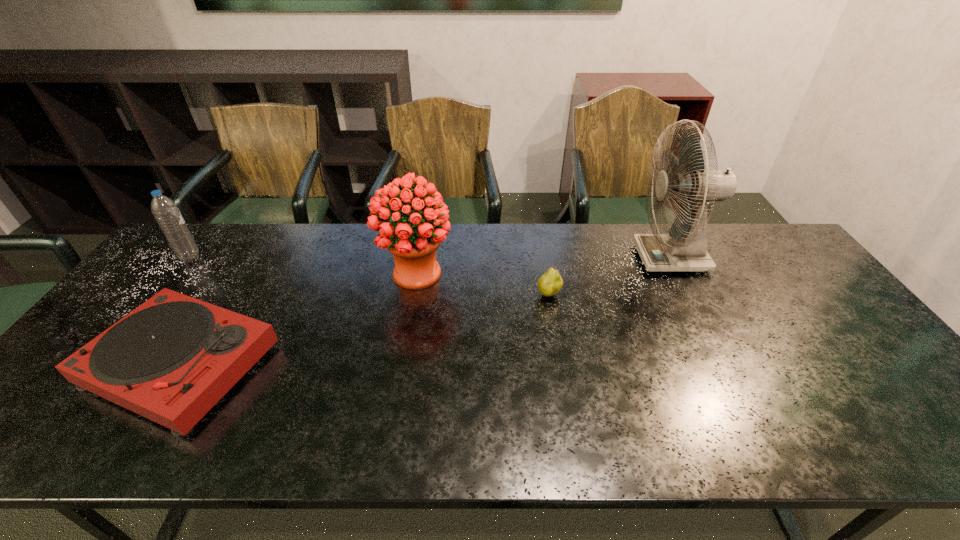
Locate an element on the screen. The height and width of the screenshot is (540, 960). fan is located at coordinates (684, 249).

Find the location of a particular element. the tallest object is located at coordinates (684, 249).

Locate an element on the screen. bouquet is located at coordinates (413, 242).

Where is `the second tallest object`? This screenshot has height=540, width=960. the second tallest object is located at coordinates (413, 242).

This screenshot has height=540, width=960. Find the location of `the third shortest object`. the third shortest object is located at coordinates (165, 211).

You are a GUI agent. You are given a task and a screenshot of the screen. Output one action in this format:
    pyautogui.click(x=<x>, y=<y>)
    Task: Click on the second object from right to left
    Image resolution: width=960 pixels, height=540 pixels.
    Given the screenshot: What is the action you would take?
    pyautogui.click(x=550, y=283)

You are a GUI agent. You are given a task and a screenshot of the screen. Output one action in this format:
    pyautogui.click(x=<x>, y=<y>)
    Task: Click on the record player
    
    Given the screenshot: What is the action you would take?
    point(170,360)

I want to click on free space located on the front-facing side of the fan, so point(568,258).

Where is `free point located on the front-facing side of the fan`? free point located on the front-facing side of the fan is located at coordinates (616, 258).

Find the location of a particular element. The height and width of the screenshot is (540, 960). vacant region located on the front-facing side of the fan is located at coordinates (560, 258).